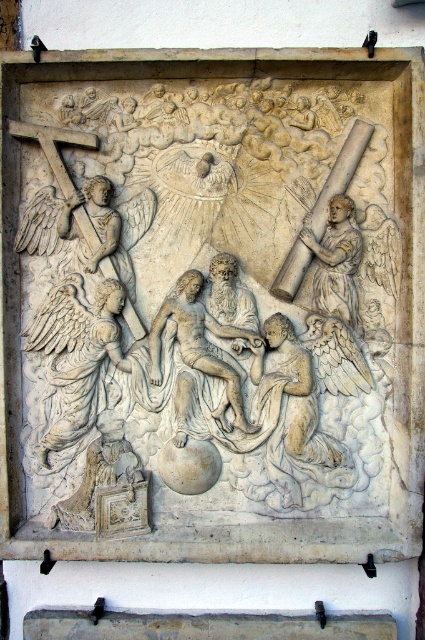
Is white stone sculpture at center above smooth stone angel at right?

Incorrect, white stone sculpture at center is not positioned above smooth stone angel at right.

Is white stone sculpture at center further to the viewer compared to smooth stone angel at right?

No, it is in front of smooth stone angel at right.

Is point (206, 92) farther from camera compared to point (320, 280)?

Yes.

At what (x,y) coordinates should I click in order to perform the action: click on white stone sculpture at center. Please return your answer as a coordinate pair (x, y). Image resolution: width=425 pixels, height=640 pixels. Looking at the image, I should click on (203, 298).